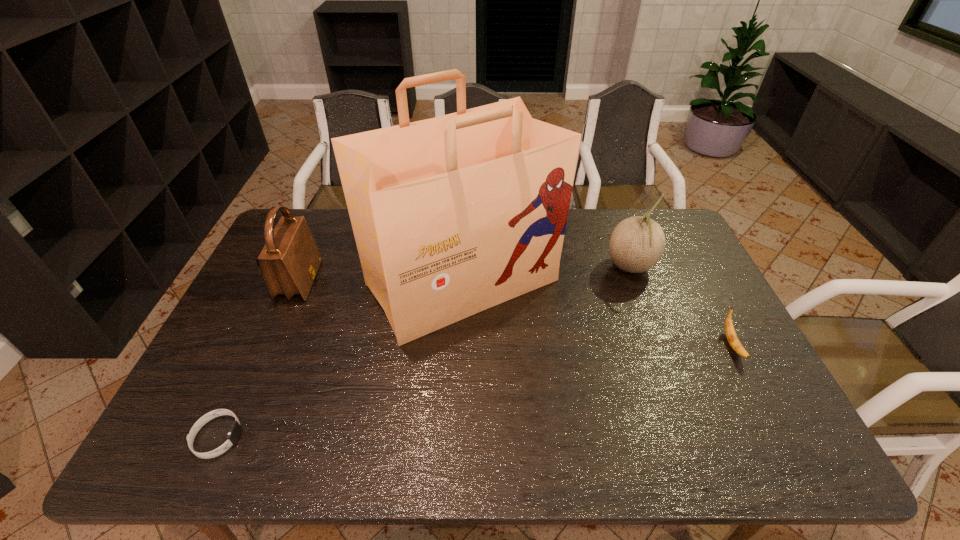
The width and height of the screenshot is (960, 540). I want to click on the tallest object, so click(452, 215).

Where is `grocery bag`? The image size is (960, 540). grocery bag is located at coordinates (452, 215).

Locate an element on the screen. This screenshot has height=540, width=960. shoulder bag is located at coordinates (289, 261).

Find the location of a particular element. This screenshot has height=540, width=960. the fourth object from left to right is located at coordinates (637, 243).

Find the location of a particular element. The width and height of the screenshot is (960, 540). the fourth tallest object is located at coordinates (731, 335).

The height and width of the screenshot is (540, 960). I want to click on banana, so click(731, 335).

This screenshot has height=540, width=960. What are the coordinates of `the nearest object` in the screenshot? It's located at (235, 431).

Locate an element on the screen. wristband is located at coordinates (235, 431).

Image resolution: width=960 pixels, height=540 pixels. Find the location of `vacant space located on the side of the third object from right to left with the superhero design`. vacant space located on the side of the third object from right to left with the superhero design is located at coordinates (456, 438).

Where is `free space located 0.120m on the front flap of the shoulder bag`? free space located 0.120m on the front flap of the shoulder bag is located at coordinates (354, 281).